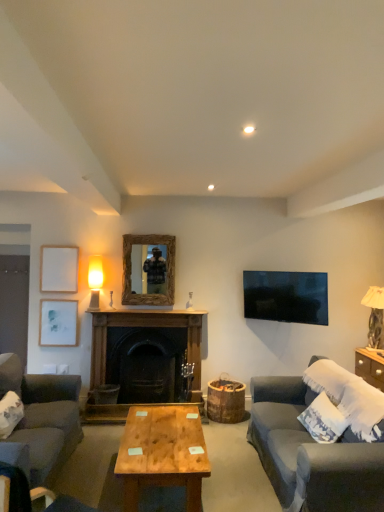
This screenshot has width=384, height=512. Find the location of `free space above wooden-framed mirror at center (from a real-world perspective)`. free space above wooden-framed mirror at center (from a real-world perspective) is located at coordinates (146, 234).